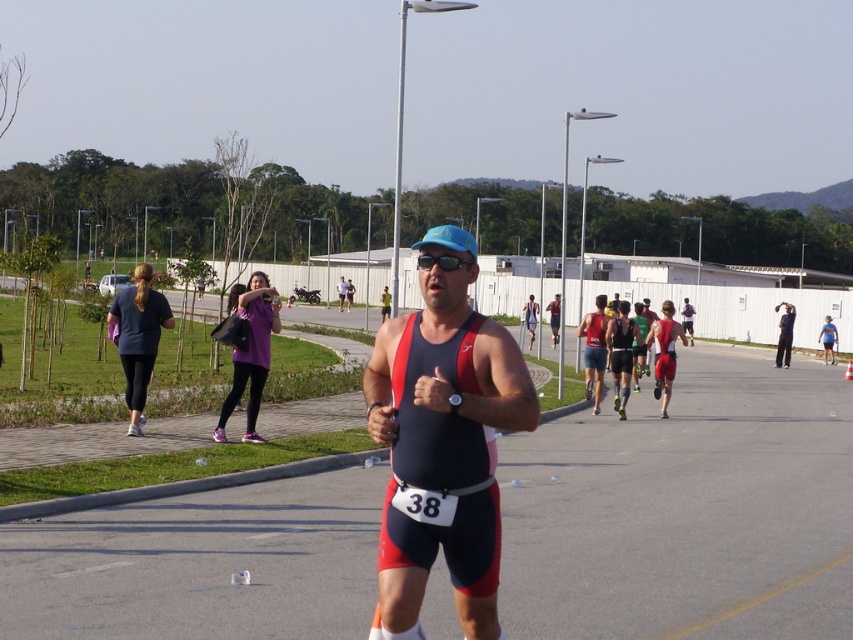
Question: Is purple fabric bag at upper left to the right of matte blue cap at center from the viewer's perspective?

Choices:
 (A) no
 (B) yes

Answer: (A)

Question: Where is matte red and black triathlon suit at center located in relation to matte blue cap at center in the image?

Choices:
 (A) left
 (B) right

Answer: (A)

Question: Estimate the real-world distances between objects in this image. Which object is closer to the purple fabric bag at upper left?

Choices:
 (A) matte red and black triathlon suit at center
 (B) matte blue cap at center
 (C) dark blue fabric running suit at left

Answer: (C)

Question: Which point is farther to the camera?

Choices:
 (A) purple fabric bag at upper left
 (B) dark blue fabric running suit at left
 (C) matte red and black triathlon suit at center

Answer: (A)

Question: Is matte red and black triathlon suit at center wider than dark blue fabric running suit at left?

Choices:
 (A) yes
 (B) no

Answer: (B)

Question: Among these points, which one is nearest to the camera?

Choices:
 (A) (270, 305)
 (B) (148, 332)
 (C) (402, 339)
 (D) (825, 362)

Answer: (C)